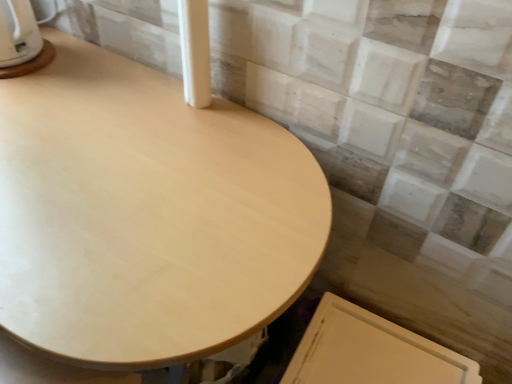
The image size is (512, 384). I want to click on vacant space to the right of white smooth pillar at upper center, so click(x=253, y=117).